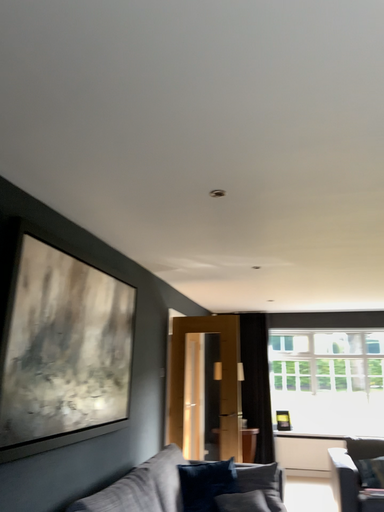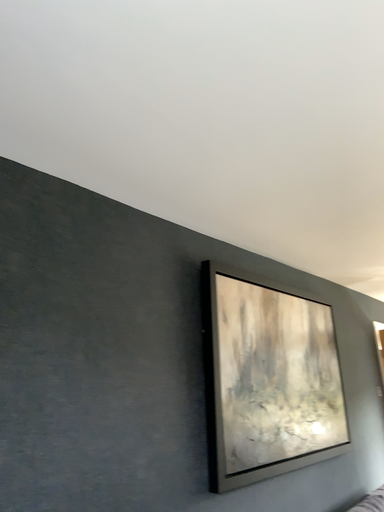
Question: Which way did the camera rotate in the video?

Choices:
 (A) rotated left
 (B) rotated right

Answer: (A)